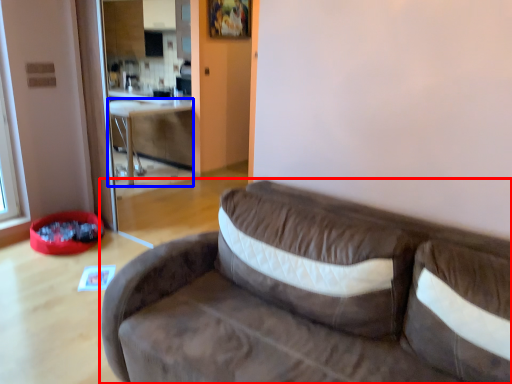
Question: Which point is further to the camera, studio couch (highlighted by a red box) or table (highlighted by a blue box)?

Choices:
 (A) studio couch
 (B) table

Answer: (B)